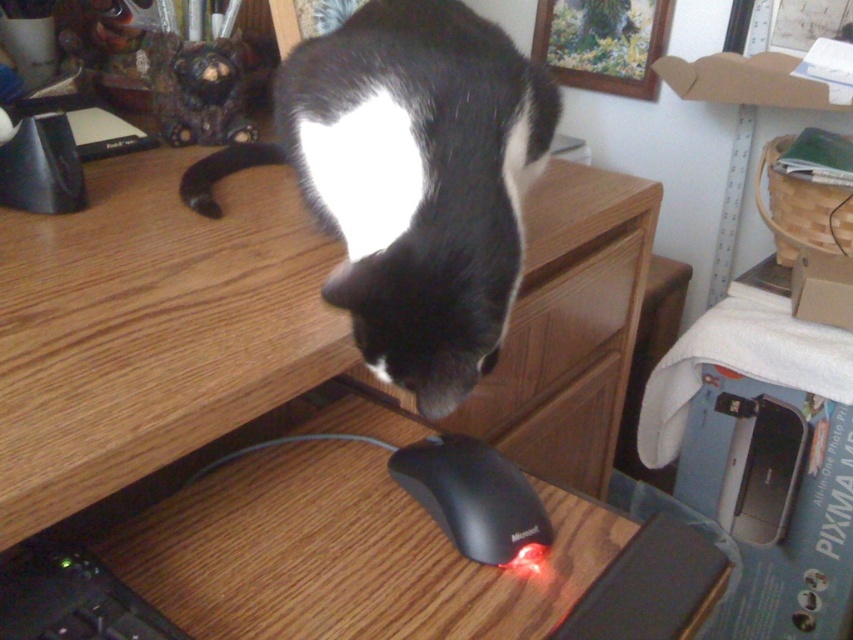
You are organizing items on a desk and need to place a small notebook between the wooden at center and the black plastic mouse at lower center. Considering their sizes, which object should the notebook be placed closer to?

The wooden at center is larger than the black plastic mouse at lower center, so the notebook should be placed closer to the black plastic mouse at lower center to ensure enough space between them.

You are a robotic assistant that needs to move the black plastic mouse at lower center to a safer location away from the black matte fur cat at center. What is the minimum distance you should move the mouse to ensure it is out of the cat s reach?

The black matte fur cat at center and black plastic mouse at lower center are 9.62 inches apart. To ensure the mouse is out of the cat s reach, you should move it at least 9.62 inches away from the cat.